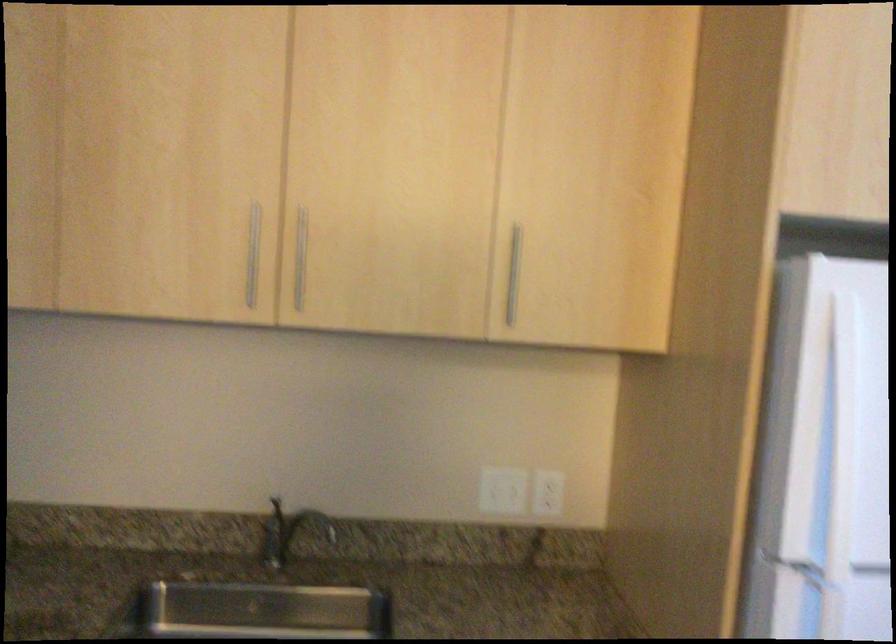
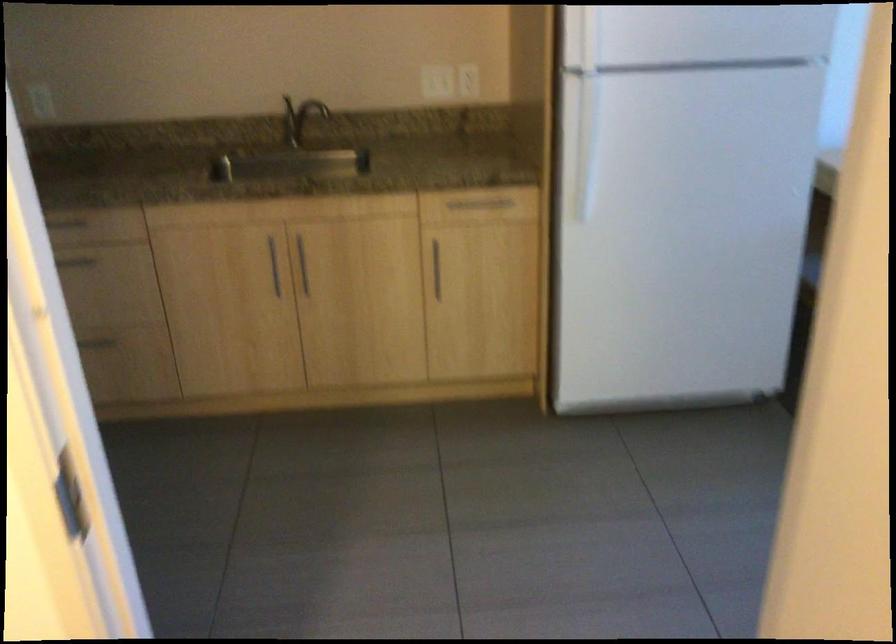
Question: What movement of the cameraman would produce the second image?

Choices:
 (A) Left
 (B) Right
 (C) Forward
 (D) Backward

Answer: (D)